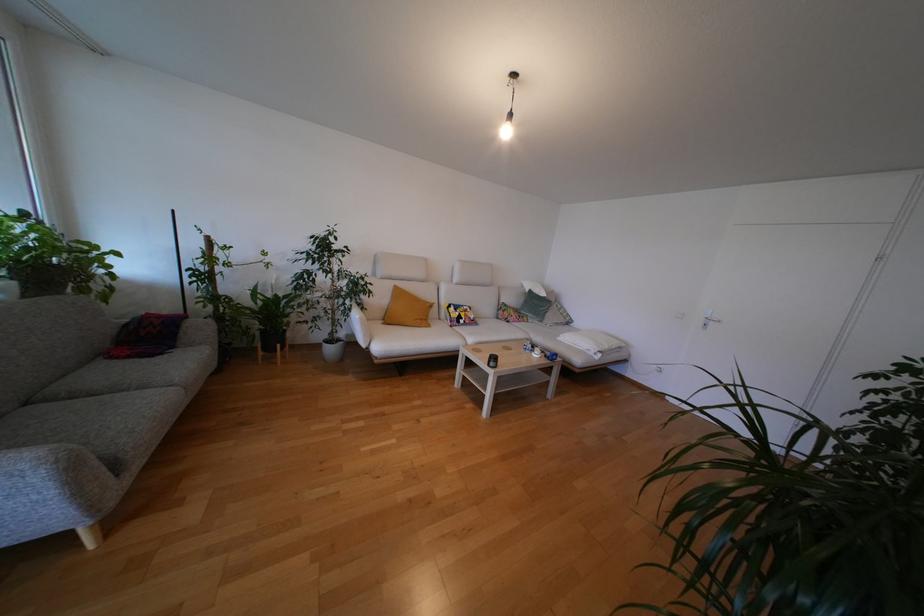
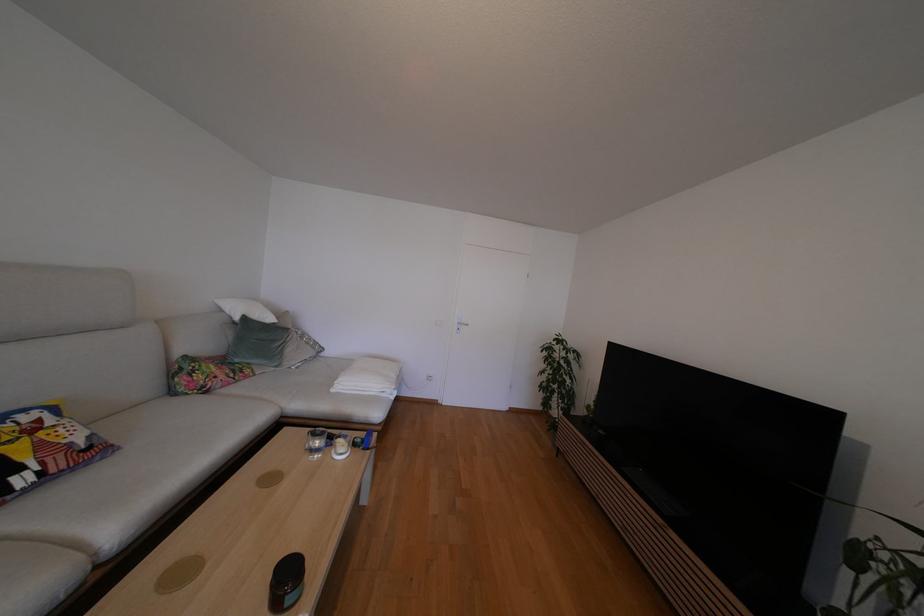
The point at (469,317) is marked in the first image. Where is the corresponding point in the second image?

(44, 448)